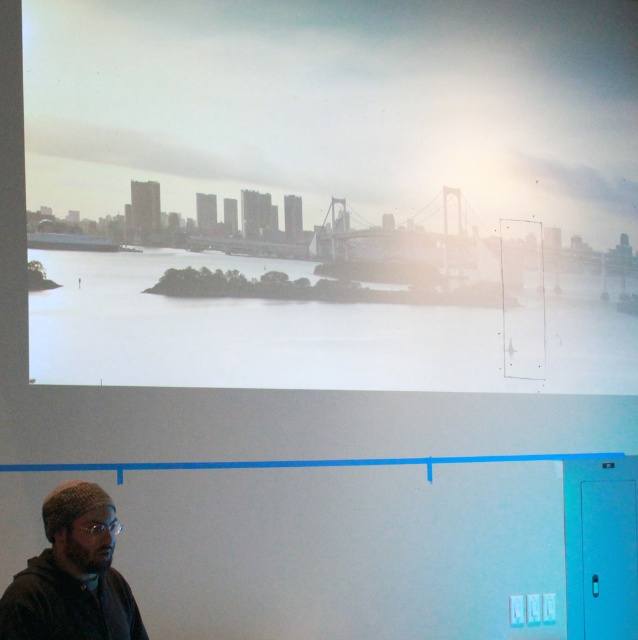
You are an event planner setting up for a presentation. You need to place a projector so that both the matte white cityscape at upper center and the knitted wool hat at lower left are visible on the screen. Given that the distance between them is 5.61 feet, what is the minimum width of the projector screen required to accommodate both objects?

The minimum width of the projector screen required to accommodate both the matte white cityscape at upper center and the knitted wool hat at lower left must be at least 5.61 feet to ensure both objects are visible on the screen.

You are an interior designer evaluating the placement of the knitted wool hat at lower left in relation to the matte white cityscape at upper center for a presentation. Considering their sizes, which object would be more eye catching from a distance?

The matte white cityscape at upper center is much taller than the knitted wool hat at lower left, making it more eye catching from a distance due to its larger size.

Looking at this image, you are setting up a projector for a presentation and need to ensure the matte white cityscape at upper center and the knitted wool hat at lower left are both visible. Given their widths, which object will require more horizontal space on the screen?

The matte white cityscape at upper center requires more horizontal space on the screen because its width surpasses that of the knitted wool hat at lower left.